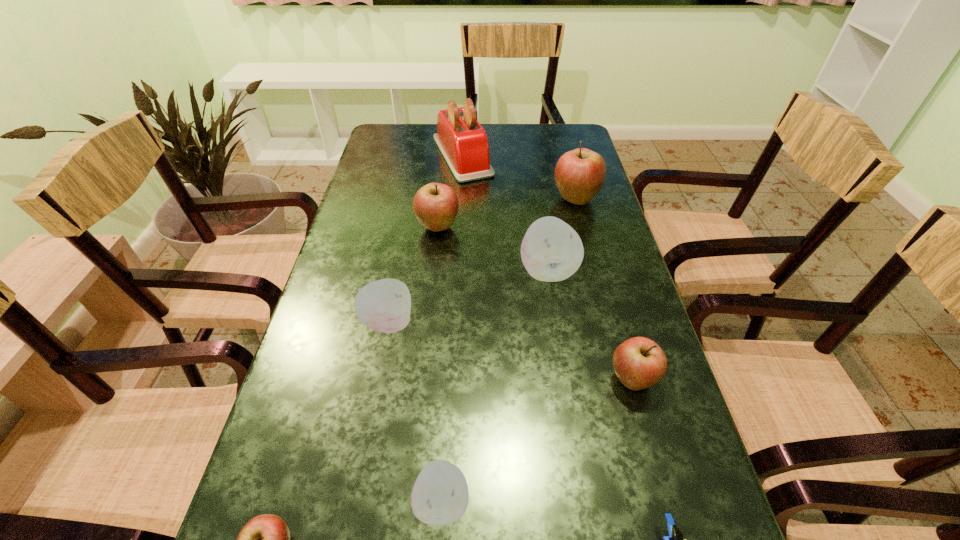
In order to click on toaster in this screenshot , I will do `click(463, 142)`.

This screenshot has width=960, height=540. What are the coordinates of `red toaster` in the screenshot? It's located at (463, 142).

This screenshot has width=960, height=540. In order to click on the biggest red apple in this screenshot , I will do `click(579, 174)`.

This screenshot has height=540, width=960. What are the coordinates of `the third red apple from right to left` in the screenshot? It's located at (435, 205).

At what (x,y) coordinates should I click in order to perform the action: click on the biggest white apple. Please return your answer as a coordinate pair (x, y). Looking at the image, I should click on (551, 250).

Find the location of a particular element. the fourth farthest object is located at coordinates (551, 250).

Where is `the leftmost white apple`? the leftmost white apple is located at coordinates (384, 305).

Locate an element on the screen. the second nearest white apple is located at coordinates (384, 305).

Find the location of a particular element. The image size is (960, 540). the third farthest red apple is located at coordinates (639, 362).

Identify the location of the third biggest red apple. (639, 362).